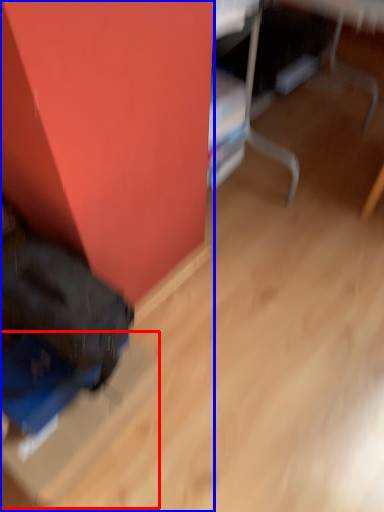
Question: Among these objects, which one is nearest to the camera, cardboard box (highlighted by a red box) or furniture (highlighted by a blue box)?

Choices:
 (A) cardboard box
 (B) furniture

Answer: (B)